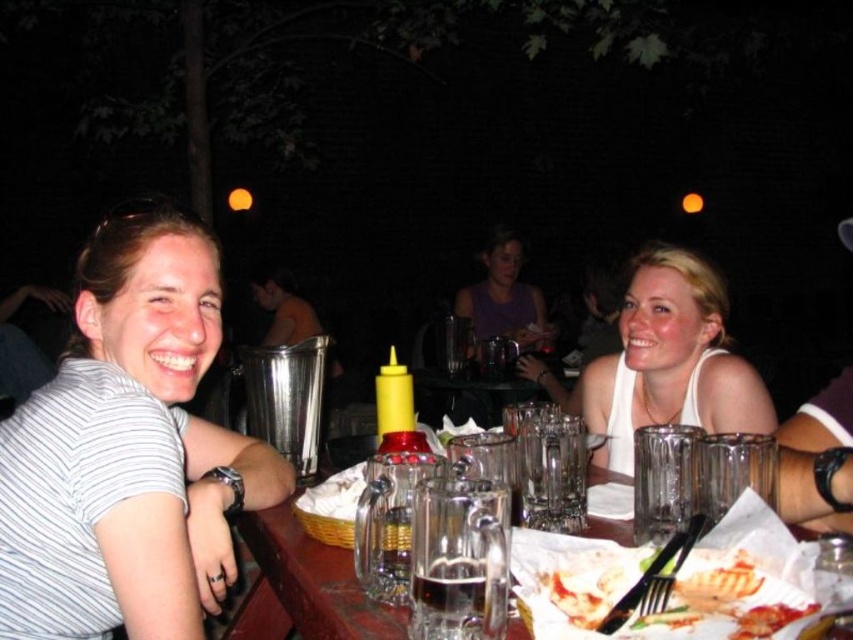
You are a photographer standing in front of the clear glass table at center and the white matte tank top at upper right. Which object is closer to you?

The white matte tank top at upper right is closer to you because it is further to the viewer than the clear glass table at center.

Looking at this image, you are a food delivery person who needs to place a new order on the table. The new order is a tall salad that is 10 cm in height. The existing items on the table are the grilled chicken at center and the translucent glass beer at table center. Based on the height of the existing items, will the salad be taller than both?

The grilled chicken at center is not as tall as the translucent glass beer at table center. Since the salad is 10 cm tall, we need to compare it with the tallest item, which is the translucent glass beer at table center. However, the height of the beer glass isn not provided, so we cannot definitively determine if the salad will be taller than both.